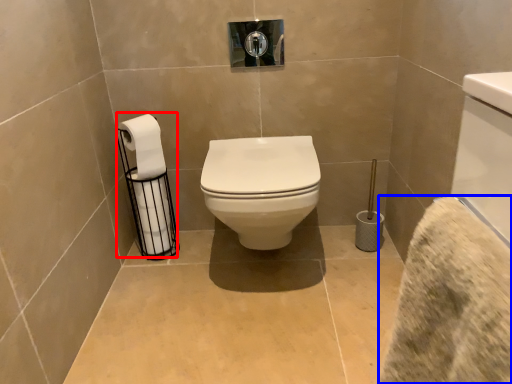
Question: Which object appears farthest to the camera in this image, toilet paper (highlighted by a red box) or bath towel (highlighted by a blue box)?

Choices:
 (A) toilet paper
 (B) bath towel

Answer: (A)